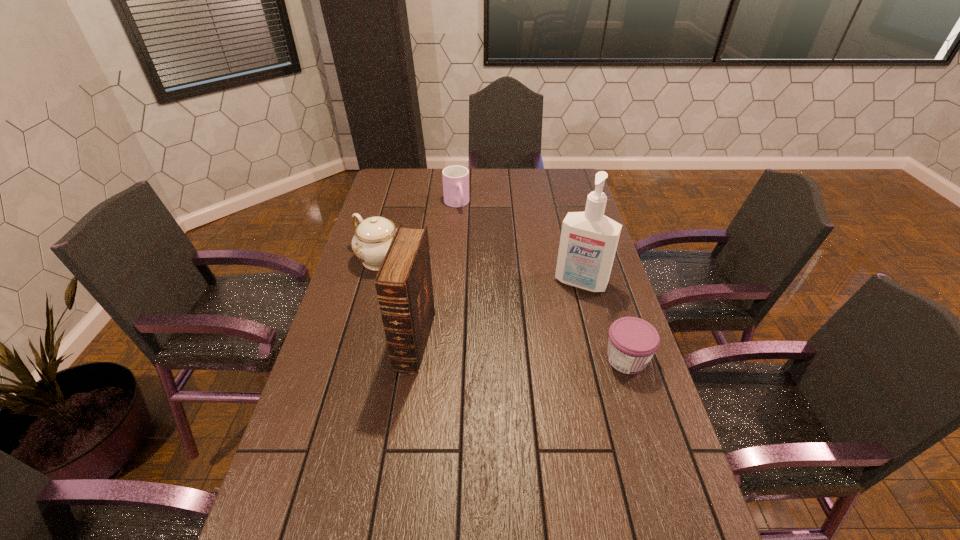
I want to click on free space located 0.280m on the front label of the tallest object, so click(x=544, y=356).

In order to click on free space located with the handle on the side of the cup in this screenshot , I will do `click(484, 269)`.

At what (x,y) coordinates should I click in order to perform the action: click on vacant space located 0.200m with the handle on the side of the cup. Please return your answer as a coordinate pair (x, y). Looking at the image, I should click on (471, 242).

Locate an element on the screen. Image resolution: width=960 pixels, height=540 pixels. vacant space situated 0.070m with the handle on the side of the cup is located at coordinates (464, 224).

I want to click on free location located at the spout of the chinaware, so click(434, 296).

Find the location of a particular element. This screenshot has height=540, width=960. vacant space located 0.170m at the spout of the chinaware is located at coordinates 431,295.

The height and width of the screenshot is (540, 960). Find the location of `free point located 0.250m at the spout of the chinaware`. free point located 0.250m at the spout of the chinaware is located at coordinates (448, 307).

The width and height of the screenshot is (960, 540). Identify the location of object that is at the far edge. pos(455,178).

Find the location of a particular element. Image resolution: width=960 pixels, height=540 pixels. object that is positioned at the left edge is located at coordinates (373, 236).

The image size is (960, 540). Find the location of `jam located at the right edge`. jam located at the right edge is located at coordinates (633, 341).